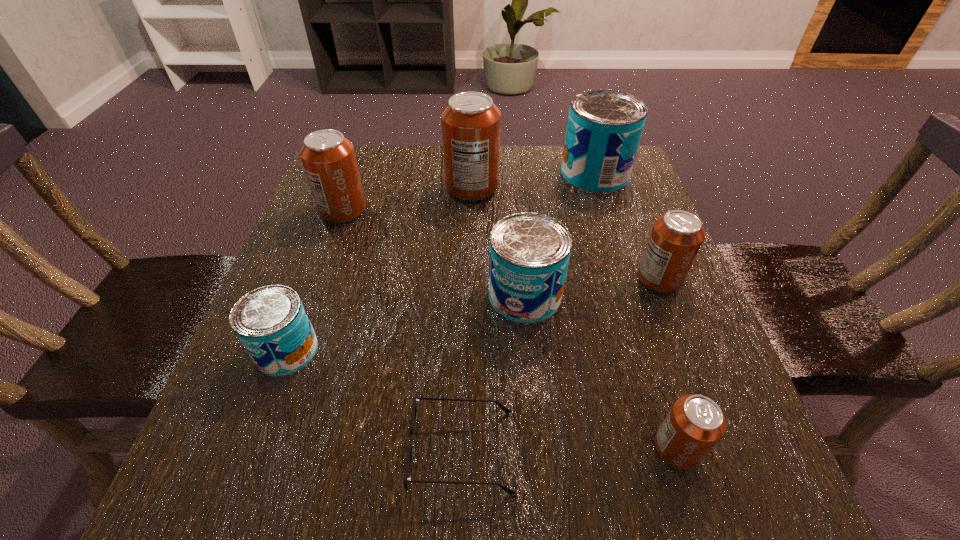
The height and width of the screenshot is (540, 960). In order to click on vacant region that satisfies the following two spatial constraints: 1. on the back side of the nearest can; 2. on the right side of the second nearest orange can in this screenshot , I will do `click(624, 279)`.